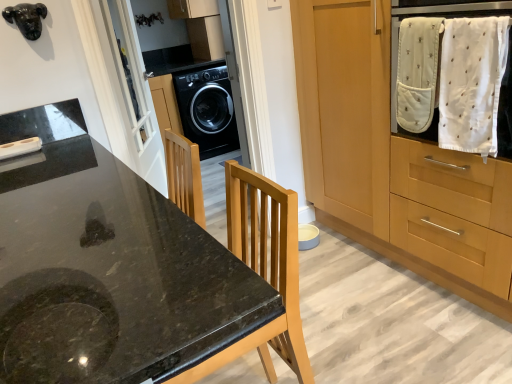
The width and height of the screenshot is (512, 384). What do you see at coordinates (461, 17) in the screenshot?
I see `white cotton towel at upper right` at bounding box center [461, 17].

Locate an element on the screen. wooden cabinet at right is located at coordinates (393, 161).

You are a GUI agent. You are given a task and a screenshot of the screen. Output one action in this format:
    pyautogui.click(x=<x>, y=<y>)
    Task: Click on the white soft cloth at upper right
    Image resolution: width=512 pixels, height=384 pixels.
    Given the screenshot: What is the action you would take?
    [418, 72]

Describe the element at coordinates (108, 268) in the screenshot. The height and width of the screenshot is (384, 512). I see `black granite countertop at center` at that location.

I want to click on black glossy washing machine at center, so click(207, 108).

Locate an element on the screen. The image size is (512, 384). white glass screen door at upper left is located at coordinates (131, 89).

I want to click on white cotton towel at upper right, so click(461, 17).

Would you say white soft cloth at upper right is a long distance from black glossy washing machine at center?

Yes.

From a real-world perspective, which object rests below the other?

From a 3D spatial view, black glossy washing machine at center is below.

You are a GUI agent. You are given a task and a screenshot of the screen. Output one action in this format:
    pyautogui.click(x=<x>, y=<y>)
    Task: Click on the washing machine below the white soft cloth at upper right (from a real-world perspective)
    
    Given the screenshot: What is the action you would take?
    pyautogui.click(x=207, y=108)

Is there a large distance between black granite countertop at center and black glossy washing machine at center?

Yes.

From the image's perspective, is black granite countertop at center located above black glossy washing machine at center?

No, from the image's perspective, black granite countertop at center is not above black glossy washing machine at center.

Which is farther from the camera, (25, 309) or (203, 109)?

Point (203, 109)

Considering the relative sizes of black granite countertop at center and black glossy washing machine at center in the image provided, is black granite countertop at center wider than black glossy washing machine at center?

Indeed, black granite countertop at center has a greater width compared to black glossy washing machine at center.

From the image's perspective, does white glass screen door at upper left appear lower than white cotton towel at upper right?

Actually, white glass screen door at upper left appears above white cotton towel at upper right in the image.

Can you tell me how much white glass screen door at upper left and white cotton towel at upper right differ in facing direction?

The angle between the facing direction of white glass screen door at upper left and the facing direction of white cotton towel at upper right is 147 degrees.

Considering the points (150, 136) and (472, 15), which point is in front, point (150, 136) or point (472, 15)?

The point (472, 15) is closer to the camera.

In the image, is black glossy washing machine at center positioned in front of or behind wooden cabinet at right?

Visually, black glossy washing machine at center is located behind wooden cabinet at right.

Can you confirm if black glossy washing machine at center is wider than wooden cabinet at right?

Incorrect, the width of black glossy washing machine at center does not surpass that of wooden cabinet at right.

This screenshot has width=512, height=384. Find the location of `washing machine above the wooden cabinet at right (from the image's perspective)`. washing machine above the wooden cabinet at right (from the image's perspective) is located at coordinates (207, 108).

Is black glossy washing machine at center oriented towards wooden cabinet at right?

Yes.

This screenshot has height=384, width=512. In order to click on home appliance lying on the right of black granite countertop at center in this screenshot , I will do `click(461, 17)`.

Between white cotton towel at upper right and black granite countertop at center, which one has larger size?

With larger size is black granite countertop at center.

Is black granite countertop at center at the back of white cotton towel at upper right?

That's not correct — white cotton towel at upper right is not looking away from black granite countertop at center.

Between white cotton towel at upper right and black granite countertop at center, which one is positioned behind?

white cotton towel at upper right is behind.

Who is taller, white cotton towel at upper right or white soft cloth at upper right?

Standing taller between the two is white cotton towel at upper right.

Does white cotton towel at upper right contain white soft cloth at upper right?

Yes, white soft cloth at upper right is a part of white cotton towel at upper right.

Considering the relative sizes of white cotton towel at upper right and white soft cloth at upper right in the image provided, is white cotton towel at upper right thinner than white soft cloth at upper right?

No.

Would you consider white cotton towel at upper right to be distant from white soft cloth at upper right?

white cotton towel at upper right is actually quite close to white soft cloth at upper right.

Is white glass screen door at upper left inside the boundaries of black granite countertop at center, or outside?

white glass screen door at upper left is located beyond the bounds of black granite countertop at center.

Is white glass screen door at upper left placed right next to black granite countertop at center?

No, white glass screen door at upper left is not next to black granite countertop at center.

Is white glass screen door at upper left to the right of black granite countertop at center from the viewer's perspective?

In fact, white glass screen door at upper left is to the left of black granite countertop at center.

Is point (130, 71) closer or farther from the camera than point (192, 297)?

Point (130, 71).

This screenshot has height=384, width=512. What are the coordinates of `baby clothe below the black glossy washing machine at center (from the image's perspective)` in the screenshot? It's located at (418, 72).

Locate an element on the screen. This screenshot has height=384, width=512. washing machine to the left of black granite countertop at center is located at coordinates (207, 108).

From the image, which object appears to be farther from black granite countertop at center, white soft cloth at upper right or wooden cabinet at right?

wooden cabinet at right.

Based on their spatial positions, is white cotton towel at upper right or black glossy washing machine at center further from black granite countertop at center?

black glossy washing machine at center is positioned further to the anchor black granite countertop at center.

When comparing their distances from black glossy washing machine at center, does black granite countertop at center or wooden cabinet at right seem closer?

wooden cabinet at right lies closer to black glossy washing machine at center than the other object.

Based on their spatial positions, is white soft cloth at upper right or black glossy washing machine at center further from black granite countertop at center?

The object further to black granite countertop at center is black glossy washing machine at center.

When comparing their distances from white soft cloth at upper right, does black granite countertop at center or black glossy washing machine at center seem further?

black glossy washing machine at center.

When comparing their distances from white cotton towel at upper right, does white soft cloth at upper right or black glossy washing machine at center seem further?

The object further to white cotton towel at upper right is black glossy washing machine at center.

Which object lies further to the anchor point black glossy washing machine at center, white glass screen door at upper left or white soft cloth at upper right?

Based on the image, white soft cloth at upper right appears to be further to black glossy washing machine at center.

From the picture: Looking at the image, which one is located closer to white soft cloth at upper right, black glossy washing machine at center or white glass screen door at upper left?

Based on the image, white glass screen door at upper left appears to be nearer to white soft cloth at upper right.

The height and width of the screenshot is (384, 512). I want to click on cabinetry between black granite countertop at center and black glossy washing machine at center in the front-back direction, so click(x=393, y=161).

What are the coordinates of `screen door positioned between wooden cabinet at right and black glossy washing machine at center from near to far` in the screenshot? It's located at (131, 89).

Where is `home appliance between wooden cabinet at right and white soft cloth at upper right along the z-axis`? This screenshot has width=512, height=384. home appliance between wooden cabinet at right and white soft cloth at upper right along the z-axis is located at coordinates (461, 17).

At what (x,y) coordinates should I click in order to perform the action: click on screen door positioned between white soft cloth at upper right and black glossy washing machine at center from near to far. Please return your answer as a coordinate pair (x, y). Image resolution: width=512 pixels, height=384 pixels. Looking at the image, I should click on (131, 89).